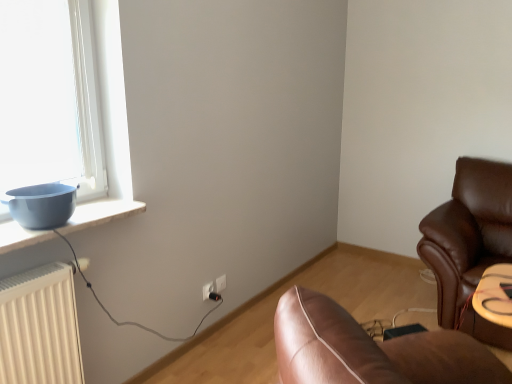
Question: From a real-world perspective, is white plastic electric outlet at lower center, the first electric outlet from the right, over white plastic electric outlet at center, the 2th electric outlet when ordered from right to left?

Choices:
 (A) no
 (B) yes

Answer: (B)

Question: Is white plastic electric outlet at lower center, the first electric outlet from the right, located outside white plastic electric outlet at center, the 2th electric outlet when ordered from right to left?

Choices:
 (A) no
 (B) yes

Answer: (B)

Question: Could you tell me if white plastic electric outlet at lower center, which is the second electric outlet from left to right, is facing white plastic electric outlet at center, the first electric outlet in the left-to-right sequence?

Choices:
 (A) no
 (B) yes

Answer: (A)

Question: Does white plastic electric outlet at lower center, the first electric outlet from the right, have a lesser width compared to white plastic electric outlet at center, the 2th electric outlet when ordered from right to left?

Choices:
 (A) yes
 (B) no

Answer: (A)

Question: Is white plastic electric outlet at lower center, which is the second electric outlet from left to right, oriented away from white plastic electric outlet at center, marked as the second electric outlet in a back-to-front arrangement?

Choices:
 (A) yes
 (B) no

Answer: (B)

Question: From a real-world perspective, relative to black plastic plug at lower center, is matte blue bowl at left vertically above or below?

Choices:
 (A) above
 (B) below

Answer: (A)

Question: Do you think matte blue bowl at left is within black plastic plug at lower center, or outside of it?

Choices:
 (A) outside
 (B) inside

Answer: (A)

Question: Is matte blue bowl at left wider or thinner than black plastic plug at lower center?

Choices:
 (A) wide
 (B) thin

Answer: (A)

Question: Visually, is matte blue bowl at left positioned to the left or to the right of black plastic plug at lower center?

Choices:
 (A) right
 (B) left

Answer: (B)

Question: Do you think black plastic plug at lower center is within white plastic electric outlet at lower center, which is the second electric outlet from left to right, or outside of it?

Choices:
 (A) outside
 (B) inside

Answer: (A)

Question: In the image, is black plastic plug at lower center positioned in front of or behind white plastic electric outlet at lower center, which is the second electric outlet from left to right?

Choices:
 (A) behind
 (B) front

Answer: (B)

Question: Would you say black plastic plug at lower center is to the left or to the right of white plastic electric outlet at lower center, placed as the first electric outlet when sorted from back to front, in the picture?

Choices:
 (A) right
 (B) left

Answer: (B)

Question: From the image's perspective, relative to white plastic electric outlet at lower center, the first electric outlet from the right, is black plastic plug at lower center above or below?

Choices:
 (A) below
 (B) above

Answer: (A)

Question: From a real-world perspective, relative to white plastic electric outlet at center, marked as the second electric outlet in a back-to-front arrangement, is white plastic electric outlet at lower center, which is the second electric outlet from left to right, vertically above or below?

Choices:
 (A) below
 (B) above

Answer: (B)

Question: In terms of width, does white plastic electric outlet at lower center, which is the second electric outlet in front-to-back order, look wider or thinner when compared to white plastic electric outlet at center, the first electric outlet in the left-to-right sequence?

Choices:
 (A) wide
 (B) thin

Answer: (B)